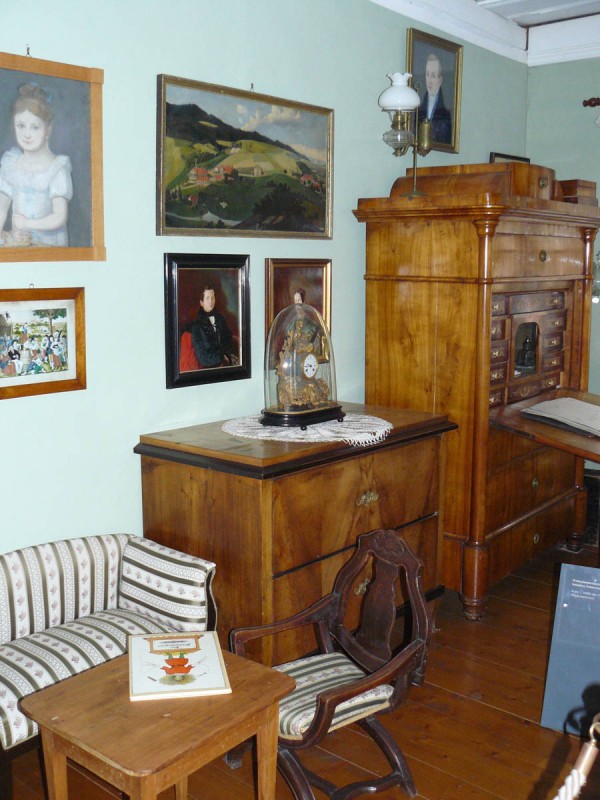
Where is `couch`? Image resolution: width=600 pixels, height=800 pixels. couch is located at coordinates tap(54, 632).